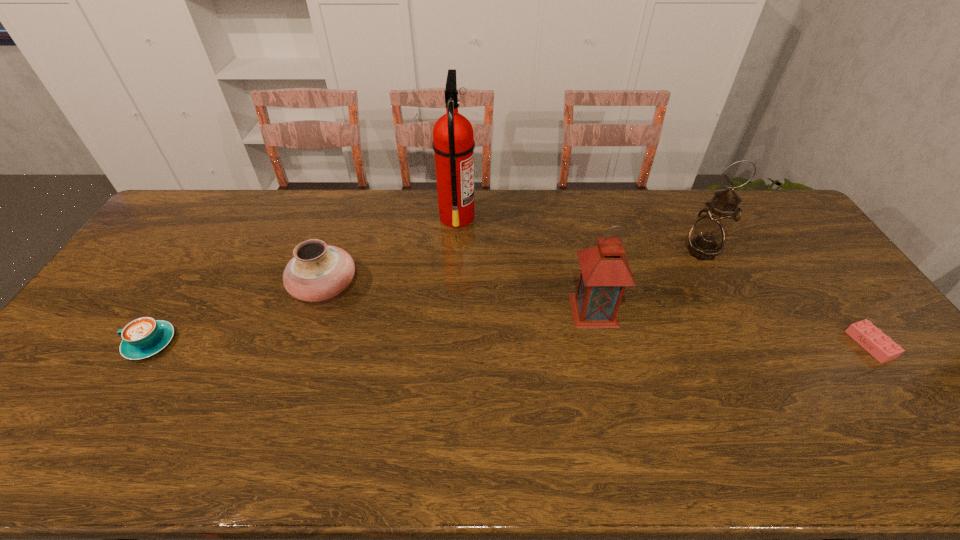
Identify the location of vacant area between the fifth object from right to left and the fourth object from left to right. (459, 299).

At what (x,y) coordinates should I click in order to perform the action: click on vacant area that lies between the second shortest object and the second object from left to right. Please return your answer as a coordinate pair (x, y). This screenshot has width=960, height=540. Looking at the image, I should click on (237, 315).

At what (x,y) coordinates should I click in order to perform the action: click on free spot between the cappuccino and the rightmost object. Please return your answer as a coordinate pair (x, y). This screenshot has width=960, height=540. Looking at the image, I should click on (510, 343).

Image resolution: width=960 pixels, height=540 pixels. In order to click on free point between the lantern and the fifth tallest object in this screenshot , I will do `click(372, 327)`.

I want to click on object that is the fifth closest to the second object from left to right, so click(x=872, y=339).

Locate which object is the fourth closest to the cappuccino. Please provide its 2D coordinates. Your answer should be formatted as a tuple, i.e. [(x, y)], where the tuple contains the x and y coordinates of a point satisfying the conditions above.

[(707, 237)]

This screenshot has width=960, height=540. Find the location of `vacant space that satisfies the following two spatial constraints: 1. on the side of the tallest object near the handle; 2. on the back side of the rightmost object`. vacant space that satisfies the following two spatial constraints: 1. on the side of the tallest object near the handle; 2. on the back side of the rightmost object is located at coordinates (449, 345).

Find the location of a particular element. This screenshot has width=960, height=540. blank space that satisfies the following two spatial constraints: 1. on the side of the fourth object from right to left near the handle; 2. on the left side of the rightmost object is located at coordinates tap(449, 345).

This screenshot has height=540, width=960. In order to click on free region that satisfies the following two spatial constraints: 1. on the front side of the third shortest object; 2. on the left side of the third object from right to left in this screenshot , I will do `click(317, 310)`.

Identify the location of vacant area that satisfies the following two spatial constraints: 1. on the side of the fire extinguisher near the handle; 2. on the front side of the second object from left to right. This screenshot has width=960, height=540. (453, 287).